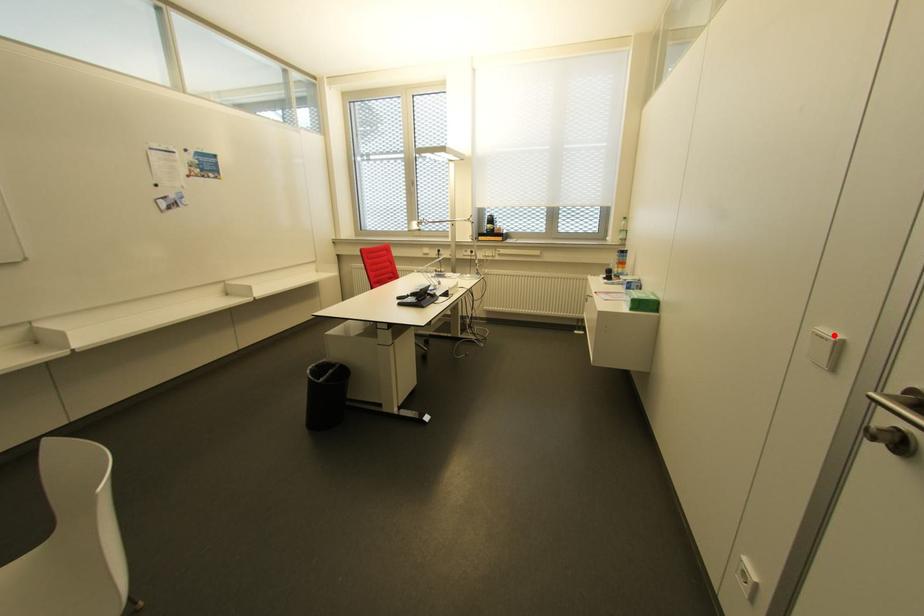
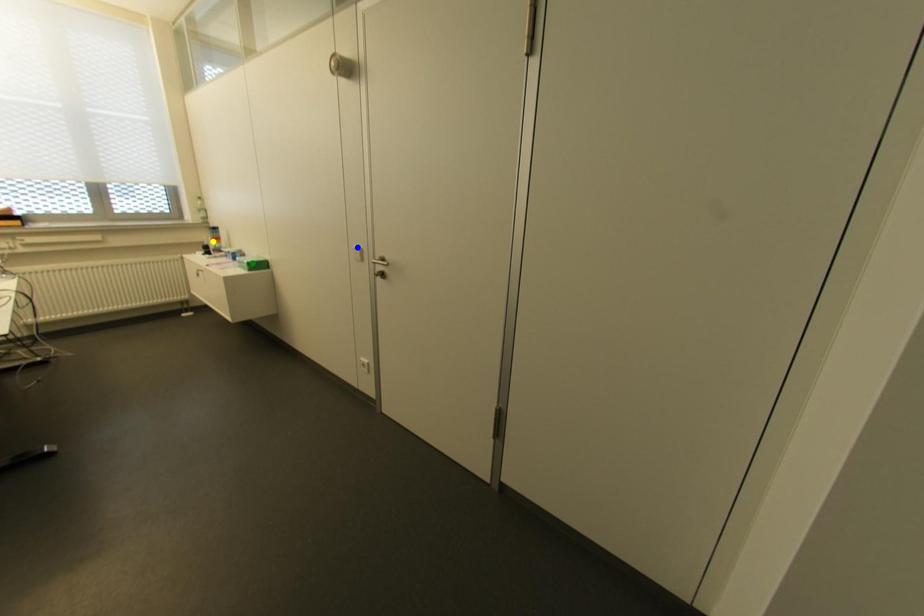
Question: I am providing you with two images of the same scene from different viewpoints. A red point is marked on the first image. You are given multiple points on the second image. Which point in image 2 is actually the same real-world point as the red point in image 1?

Choices:
 (A) green point
 (B) blue point
 (C) yellow point

Answer: (B)